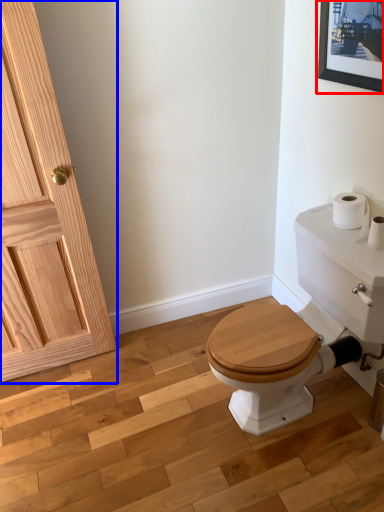
Question: Which object appears closest to the camera in this image, picture frame (highlighted by a red box) or door (highlighted by a blue box)?

Choices:
 (A) picture frame
 (B) door

Answer: (B)